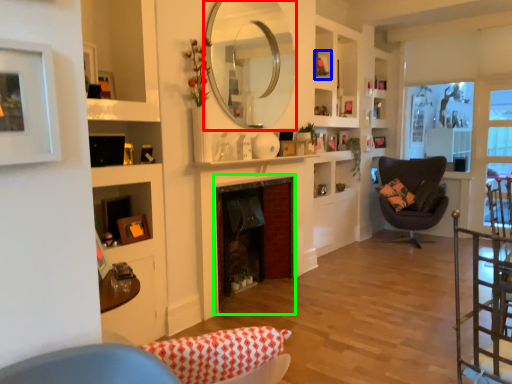
Question: Which object is the farthest from mirror (highlighted by a red box)? Choose among these: picture frame (highlighted by a blue box) or fireplace (highlighted by a green box).

Choices:
 (A) picture frame
 (B) fireplace

Answer: (A)